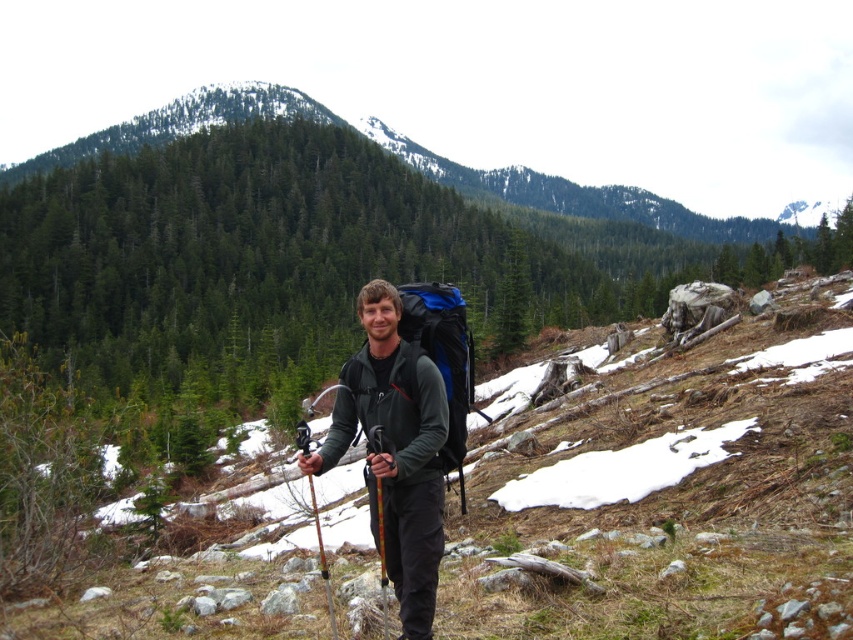
Question: Estimate the real-world distances between objects in this image. Which object is farther from the wooden textured ski pole at center?

Choices:
 (A) matte black backpack at center
 (B) matte black ski pole at center
 (C) green forested mountain at upper center
 (D) matte black jacket at center

Answer: (C)

Question: Is green forested mountain at upper center to the right of matte black ski pole at center from the viewer's perspective?

Choices:
 (A) yes
 (B) no

Answer: (A)

Question: Which of these objects is positioned farthest from the matte black backpack at center?

Choices:
 (A) matte black ski pole at center
 (B) matte black jacket at center
 (C) wooden textured ski pole at center

Answer: (C)

Question: Can you confirm if matte black jacket at center is wider than matte black ski pole at center?

Choices:
 (A) no
 (B) yes

Answer: (A)

Question: Which object is farther from the camera taking this photo?

Choices:
 (A) green forested mountain at upper center
 (B) wooden textured ski pole at center

Answer: (A)

Question: Does wooden textured ski pole at center have a greater width compared to matte black ski pole at center?

Choices:
 (A) no
 (B) yes

Answer: (A)